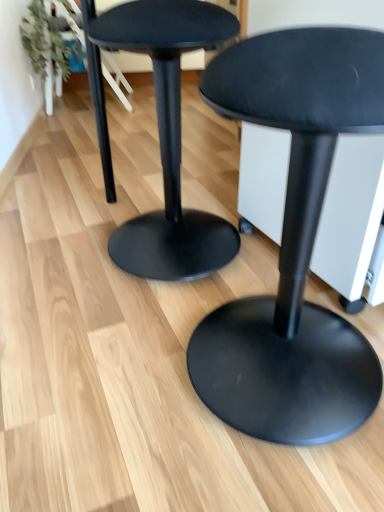
Question: Which direction should I rotate to look at matte black stool at center, marked as the second stool in a left-to-right arrangement?

Choices:
 (A) left
 (B) right

Answer: (B)

Question: Considering the relative positions of matte black stool at center, the 1th stool positioned from the right, and matte black stool at center, the first stool viewed from the left, in the image provided, is matte black stool at center, the 1th stool positioned from the right, to the right of matte black stool at center, the first stool viewed from the left, from the viewer's perspective?

Choices:
 (A) yes
 (B) no

Answer: (A)

Question: Is matte black stool at center, marked as the second stool in a left-to-right arrangement, aimed at matte black stool at center, the first stool viewed from the left?

Choices:
 (A) yes
 (B) no

Answer: (B)

Question: From a real-world perspective, is matte black stool at center, marked as the second stool in a left-to-right arrangement, below matte black stool at center, the first stool viewed from the left?

Choices:
 (A) yes
 (B) no

Answer: (A)

Question: From a real-world perspective, is matte black stool at center, the 1th stool positioned from the right, over matte black stool at center, which appears as the 2th stool when viewed from the right?

Choices:
 (A) yes
 (B) no

Answer: (B)

Question: Are matte black stool at center, marked as the second stool in a left-to-right arrangement, and matte black stool at center, which appears as the 2th stool when viewed from the right, far apart?

Choices:
 (A) no
 (B) yes

Answer: (A)

Question: Considering the relative sizes of matte black stool at center, marked as the second stool in a left-to-right arrangement, and matte black stool at center, the first stool viewed from the left, in the image provided, is matte black stool at center, marked as the second stool in a left-to-right arrangement, wider than matte black stool at center, the first stool viewed from the left,?

Choices:
 (A) no
 (B) yes

Answer: (B)

Question: From the image's perspective, is matte black stool at center, which appears as the 2th stool when viewed from the right, below matte black stool at center, marked as the second stool in a left-to-right arrangement?

Choices:
 (A) yes
 (B) no

Answer: (B)

Question: Is matte black stool at center, which appears as the 2th stool when viewed from the right, completely or partially outside of matte black stool at center, marked as the second stool in a left-to-right arrangement?

Choices:
 (A) yes
 (B) no

Answer: (A)

Question: Is matte black stool at center, which appears as the 2th stool when viewed from the right, facing towards matte black stool at center, the 1th stool positioned from the right?

Choices:
 (A) yes
 (B) no

Answer: (B)

Question: Is the depth of matte black stool at center, the first stool viewed from the left, less than that of matte black stool at center, marked as the second stool in a left-to-right arrangement?

Choices:
 (A) no
 (B) yes

Answer: (A)

Question: Can you confirm if matte black stool at center, which appears as the 2th stool when viewed from the right, is wider than matte black stool at center, marked as the second stool in a left-to-right arrangement?

Choices:
 (A) no
 (B) yes

Answer: (A)

Question: Does matte black stool at center, which appears as the 2th stool when viewed from the right, contain matte black stool at center, the 1th stool positioned from the right?

Choices:
 (A) no
 (B) yes

Answer: (A)

Question: Is point (244, 54) closer or farther from the camera than point (200, 23)?

Choices:
 (A) closer
 (B) farther

Answer: (A)